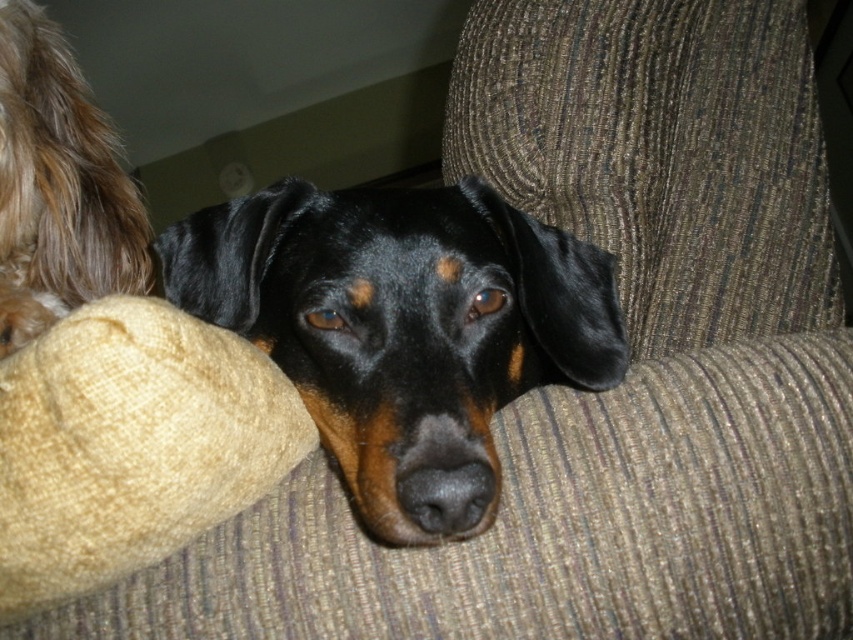
How distant is black shiny dog at center from fuzzy brown fur at upper left?

13.19 inches

Can you confirm if black shiny dog at center is wider than fuzzy brown fur at upper left?

Yes, black shiny dog at center is wider than fuzzy brown fur at upper left.

Which is in front, point (436, 198) or point (3, 104)?

Point (436, 198) is more forward.

Where is `black shiny dog at center`? The image size is (853, 640). black shiny dog at center is located at coordinates (403, 328).